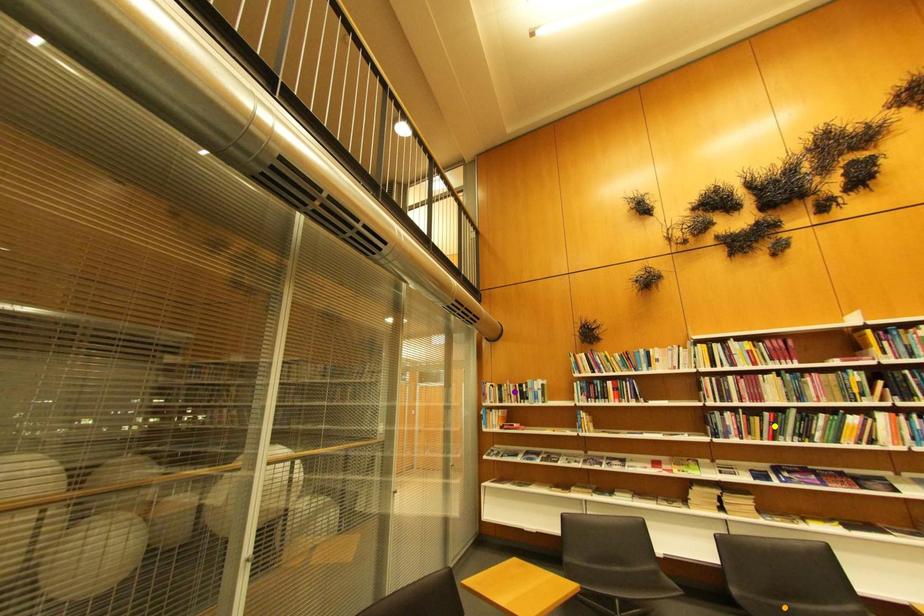
Order these from nearest to farthest:
1. orange point
2. yellow point
3. purple point

orange point → yellow point → purple point